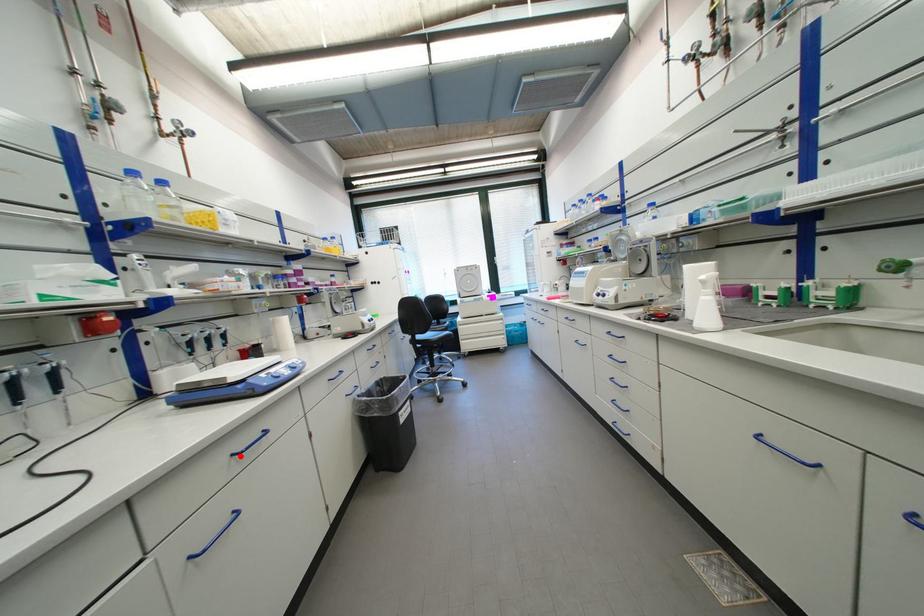
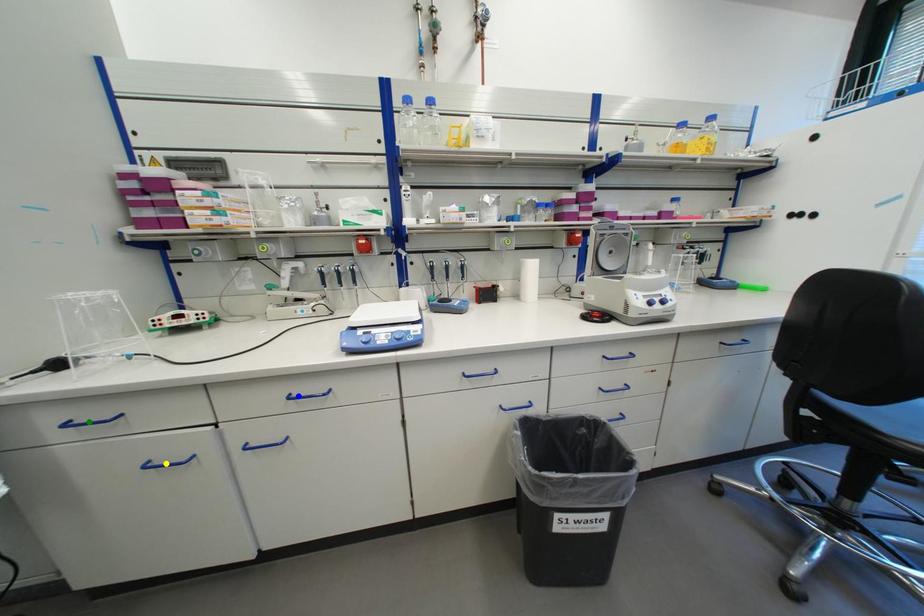
Question: I am providing you with two images of the same scene from different viewpoints. A red point is marked on the first image. You are given multiple points on the second image. Which spot in image 2 lines up with the point in image 1?

Choices:
 (A) green point
 (B) blue point
 (C) yellow point

Answer: (B)